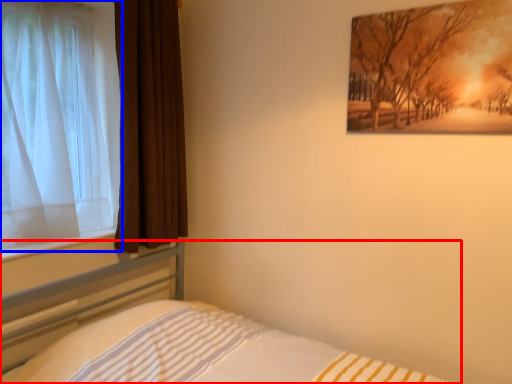
Question: Which object appears closest to the camera in this image, bed (highlighted by a red box) or curtain (highlighted by a blue box)?

Choices:
 (A) bed
 (B) curtain

Answer: (A)